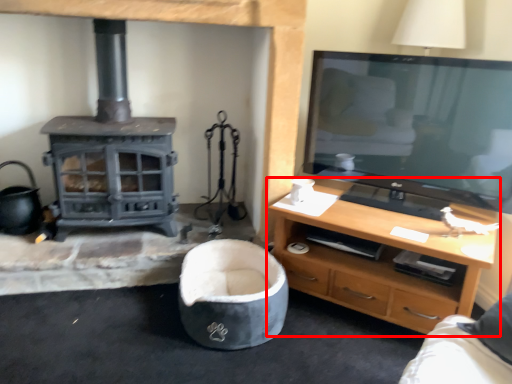
Question: From the image's perspective, considering the relative positions of desk (annotated by the red box) and bean bag chair in the image provided, where is desk (annotated by the red box) located with respect to the staircase?

Choices:
 (A) above
 (B) below

Answer: (A)